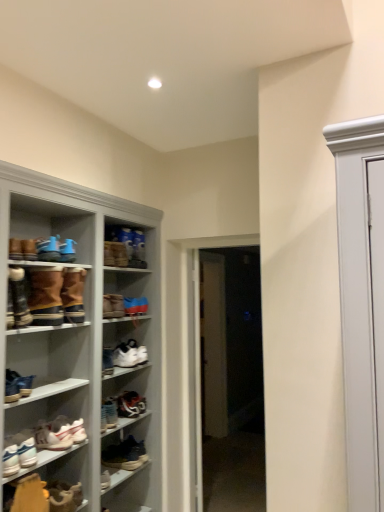
You are a GUI agent. You are given a task and a screenshot of the screen. Output one action in this format:
    pyautogui.click(x=<x>, y=<y>)
    Task: Click on the matte white sneaker at lower left, placed as the 7th footwear when sorted from top to bottom
    The image size is (384, 512).
    Given the screenshot: What is the action you would take?
    pyautogui.click(x=17, y=386)

Locate an element on the screen. The image size is (384, 512). brown suede boot at center, the 3th footwear when ordered from top to bottom is located at coordinates [115, 254].

The height and width of the screenshot is (512, 384). What do you see at coordinates (44, 249) in the screenshot?
I see `blue suede sneakers at upper left, placed as the twelfth footwear when sorted from bottom to top` at bounding box center [44, 249].

Image resolution: width=384 pixels, height=512 pixels. I want to click on white leather sneaker at lower left, which is the 2th shoe in top-to-bottom order, so click(21, 448).

You are a GUI agent. You are given a task and a screenshot of the screen. Output one action in this format:
    pyautogui.click(x=<x>, y=<y>)
    Task: Click on the matte white sneaker at lower left, the seventh footwear positioned from the bottom
    The width and height of the screenshot is (384, 512).
    Given the screenshot: What is the action you would take?
    pyautogui.click(x=17, y=386)

From the picture: From a real-world perspective, between leather boot at left, marked as the fourth footwear in a top-to-bottom arrangement, and leather boot at lower left, the 2th footwear in the bottom-to-top sequence, who is vertically lower?

leather boot at lower left, the 2th footwear in the bottom-to-top sequence.

Considering the positions of objects leather boot at left, marked as the fourth footwear in a top-to-bottom arrangement, and leather boot at lower left, the 2th footwear in the bottom-to-top sequence, in the image provided, who is more to the right, leather boot at left, marked as the fourth footwear in a top-to-bottom arrangement, or leather boot at lower left, the 2th footwear in the bottom-to-top sequence,?

Positioned to the right is leather boot at lower left, the 2th footwear in the bottom-to-top sequence.

Considering the relative sizes of leather boot at left, marked as the fourth footwear in a top-to-bottom arrangement, and leather boot at lower left, the 2th footwear in the bottom-to-top sequence, in the image provided, is leather boot at left, marked as the fourth footwear in a top-to-bottom arrangement, bigger than leather boot at lower left, the 2th footwear in the bottom-to-top sequence,?

Yes.

What are the coordinates of `the 8th footwear below when counting from the leather boot at left, acting as the 10th footwear starting from the bottom (from the image's perspective)` in the screenshot? It's located at (64, 496).

Does brown suede boot at upper center, which is the first footwear from top to bottom, touch brown suede boots at left, the 9th footwear from the bottom?

No, brown suede boot at upper center, which is the first footwear from top to bottom, is not beside brown suede boots at left, the 9th footwear from the bottom.

Is brown suede boot at upper center, arranged as the thirteenth footwear when ordered from the bottom, thinner than brown suede boots at left, the 9th footwear from the bottom?

Correct, the width of brown suede boot at upper center, arranged as the thirteenth footwear when ordered from the bottom, is less than that of brown suede boots at left, the 9th footwear from the bottom.

Which object is positioned more to the right, brown suede boot at upper center, arranged as the thirteenth footwear when ordered from the bottom, or brown suede boots at left, which ranks as the 5th footwear in top-to-bottom order?

Positioned to the right is brown suede boot at upper center, arranged as the thirteenth footwear when ordered from the bottom.

From a real-world perspective, is brown suede boot at upper center, arranged as the thirteenth footwear when ordered from the bottom, positioned above or below brown suede boots at left, which ranks as the 5th footwear in top-to-bottom order?

brown suede boot at upper center, arranged as the thirteenth footwear when ordered from the bottom, is situated higher than brown suede boots at left, which ranks as the 5th footwear in top-to-bottom order, in the real world.

Which is more to the left, white glossy door at center, arranged as the 2th door when viewed from the left, or white matte sneakers at lower left, acting as the fifth footwear starting from the bottom?

Positioned to the left is white matte sneakers at lower left, acting as the fifth footwear starting from the bottom.

Based on the photo, is white glossy door at center, arranged as the 2th door when viewed from the left, facing towards white matte sneakers at lower left, marked as the 9th footwear in a top-to-bottom arrangement?

No, white glossy door at center, arranged as the 2th door when viewed from the left, is not turned towards white matte sneakers at lower left, marked as the 9th footwear in a top-to-bottom arrangement.

From a real-world perspective, between white glossy door at center, marked as the 1th door in a right-to-left arrangement, and white matte sneakers at lower left, acting as the fifth footwear starting from the bottom, who is vertically lower?

white matte sneakers at lower left, acting as the fifth footwear starting from the bottom, from a real-world perspective.

Is white glossy door at center, arranged as the 2th door when viewed from the left, completely or partially outside of white matte sneakers at lower left, acting as the fifth footwear starting from the bottom?

That's correct, white glossy door at center, arranged as the 2th door when viewed from the left, is outside of white matte sneakers at lower left, acting as the fifth footwear starting from the bottom.

Does point (79, 482) come closer to viewer compared to point (66, 309)?

No.

Would you say brown suede boots at left, the 6th footwear in the top-to-bottom sequence, is part of leather boot at lower left, the 2th footwear in the bottom-to-top sequence,'s contents?

Definitely not — brown suede boots at left, the 6th footwear in the top-to-bottom sequence, is not inside leather boot at lower left, the 2th footwear in the bottom-to-top sequence.

From a real-world perspective, is leather boot at lower left, the 2th footwear in the bottom-to-top sequence, physically below brown suede boots at left, acting as the 8th footwear starting from the bottom?

Correct, in the physical world, leather boot at lower left, the 2th footwear in the bottom-to-top sequence, is lower than brown suede boots at left, acting as the 8th footwear starting from the bottom.

Considering the relative sizes of white matte sneakers at lower left, marked as the 9th footwear in a top-to-bottom arrangement, and white glossy door at center, marked as the 1th door in a right-to-left arrangement, in the image provided, is white matte sneakers at lower left, marked as the 9th footwear in a top-to-bottom arrangement, shorter than white glossy door at center, marked as the 1th door in a right-to-left arrangement,?

Yes.

Between white matte sneakers at lower left, acting as the fifth footwear starting from the bottom, and white glossy door at center, arranged as the 2th door when viewed from the left, which one has larger size?

Bigger between the two is white glossy door at center, arranged as the 2th door when viewed from the left.

Is white matte sneakers at lower left, marked as the 9th footwear in a top-to-bottom arrangement, to the right of white glossy door at center, arranged as the 2th door when viewed from the left, from the viewer's perspective?

No.

The height and width of the screenshot is (512, 384). I want to click on the 5th footwear in front of the white glossy door at center, arranged as the 2th door when viewed from the left, starting your count from the anchor, so click(69, 429).

In the scene shown: Considering the positions of objects brown suede boots at left, acting as the 8th footwear starting from the bottom, and shiny blue sneaker at center, the 2th shoe from the left, in the image provided, who is in front, brown suede boots at left, acting as the 8th footwear starting from the bottom, or shiny blue sneaker at center, the 2th shoe from the left,?

brown suede boots at left, acting as the 8th footwear starting from the bottom.

From a real-world perspective, which is physically below, brown suede boots at left, the 6th footwear in the top-to-bottom sequence, or shiny blue sneaker at center, the 1th shoe positioned from the right?

shiny blue sneaker at center, the 1th shoe positioned from the right.

From the image's perspective, between brown suede boots at left, acting as the 8th footwear starting from the bottom, and shiny blue sneaker at center, the 2th shoe from the left, who is located below?

shiny blue sneaker at center, the 2th shoe from the left, appears lower in the image.

How much distance is there between blue suede sneakers at upper left, acting as the 2th footwear starting from the top, and brown suede boots at left, acting as the 8th footwear starting from the bottom?

blue suede sneakers at upper left, acting as the 2th footwear starting from the top, is 7.32 inches away from brown suede boots at left, acting as the 8th footwear starting from the bottom.

From the image's perspective, which is below, blue suede sneakers at upper left, acting as the 2th footwear starting from the top, or brown suede boots at left, acting as the 8th footwear starting from the bottom?

From the image's view, brown suede boots at left, acting as the 8th footwear starting from the bottom, is below.

Is brown suede boots at left, the 6th footwear in the top-to-bottom sequence, inside blue suede sneakers at upper left, acting as the 2th footwear starting from the top?

Definitely not — brown suede boots at left, the 6th footwear in the top-to-bottom sequence, is not inside blue suede sneakers at upper left, acting as the 2th footwear starting from the top.

The height and width of the screenshot is (512, 384). I want to click on the 7th footwear located beneath the leather boot at left, acting as the 10th footwear starting from the bottom (from a real-world perspective), so click(x=64, y=496).

Which footwear is the 8th one when counting from the front of the brown suede boot at upper center, which is the first footwear from top to bottom? Please provide its 2D coordinates.

[(56, 296)]

From the image, which object appears to be nearer to leather sneaker at lower center, the 1th footwear positioned from the bottom, brown suede boots at left, the 9th footwear from the bottom, or white glossy door at center, marked as the 1th door in a right-to-left arrangement?

brown suede boots at left, the 9th footwear from the bottom, is closer to leather sneaker at lower center, the 1th footwear positioned from the bottom.

Considering their positions, is white leather sneaker at center, which is the 8th footwear from top to bottom, positioned closer to brown suede boots at left, acting as the 8th footwear starting from the bottom, than leather boot at lower left, the 2th footwear in the bottom-to-top sequence?

white leather sneaker at center, which is the 8th footwear from top to bottom, lies closer to brown suede boots at left, acting as the 8th footwear starting from the bottom, than the other object.

Estimate the real-world distances between objects in this image. Which object is further from brown suede boots at left, the 9th footwear from the bottom, leather boot at lower left, the 2th footwear in the bottom-to-top sequence, or white leather sneaker at lower left, which is the 2th shoe in top-to-bottom order?

leather boot at lower left, the 2th footwear in the bottom-to-top sequence.

Which object lies further to the anchor point white glossy door at center, marked as the 1th door in a right-to-left arrangement, white matte sneakers at lower left, marked as the 9th footwear in a top-to-bottom arrangement, or brown suede boots at left, acting as the 8th footwear starting from the bottom?

Among the two, brown suede boots at left, acting as the 8th footwear starting from the bottom, is located further to white glossy door at center, marked as the 1th door in a right-to-left arrangement.

Based on their spatial positions, is white leather sneaker at center, which is the 8th footwear from top to bottom, or matte white sneaker at lower left, the seventh footwear positioned from the bottom, further from brown suede boot at center, the 11th footwear when ordered from bottom to top?

The object further to brown suede boot at center, the 11th footwear when ordered from bottom to top, is matte white sneaker at lower left, the seventh footwear positioned from the bottom.

Based on their spatial positions, is white leather sneaker at center, the 6th footwear from the bottom, or leather boot at left, acting as the 10th footwear starting from the bottom, closer to white glossy door at center, marked as the 1th door in a right-to-left arrangement?

white leather sneaker at center, the 6th footwear from the bottom, is positioned closer to the anchor white glossy door at center, marked as the 1th door in a right-to-left arrangement.

Consider the image. Considering their positions, is brown suede boots at left, the 6th footwear in the top-to-bottom sequence, positioned further to shiny blue sneaker at center, the 1th shoe positioned from the right, than white glossy door at center, which is counted as the second door, starting from the right?

Based on the image, white glossy door at center, which is counted as the second door, starting from the right, appears to be further to shiny blue sneaker at center, the 1th shoe positioned from the right.

Based on their spatial positions, is leather sneaker at lower center, which is the 13th footwear in top-to-bottom order, or white matte sneakers at lower left, marked as the 9th footwear in a top-to-bottom arrangement, further from white glossy door at center, arranged as the 2th door when viewed from the left?

white matte sneakers at lower left, marked as the 9th footwear in a top-to-bottom arrangement.

This screenshot has height=512, width=384. In order to click on shoe between brown suede boot at upper center, arranged as the thirteenth footwear when ordered from the bottom, and white leather sneaker at center, which is the 8th footwear from top to bottom, from top to bottom in this screenshot , I will do `click(135, 306)`.

Where is `shoe located between leather boot at left, marked as the fourth footwear in a top-to-bottom arrangement, and white glossy door at center, arranged as the 2th door when viewed from the left, in the left-right direction`? Image resolution: width=384 pixels, height=512 pixels. shoe located between leather boot at left, marked as the fourth footwear in a top-to-bottom arrangement, and white glossy door at center, arranged as the 2th door when viewed from the left, in the left-right direction is located at coordinates (135, 306).

Locate an element on the screen. The image size is (384, 512). shoe situated between brown suede boots at left, the 6th footwear in the top-to-bottom sequence, and white glossy door at center, marked as the 1th door in a right-to-left arrangement, from left to right is located at coordinates (135, 306).

You are a GUI agent. You are given a task and a screenshot of the screen. Output one action in this format:
    pyautogui.click(x=<x>, y=<y>)
    Task: Click on the door that lies between brown suede boot at center, the 11th footwear when ordered from bottom to top, and shiny black sneaker at center, the fourth footwear in the bottom-to-top sequence, from top to bottom
    The width and height of the screenshot is (384, 512).
    Given the screenshot: What is the action you would take?
    pyautogui.click(x=232, y=380)